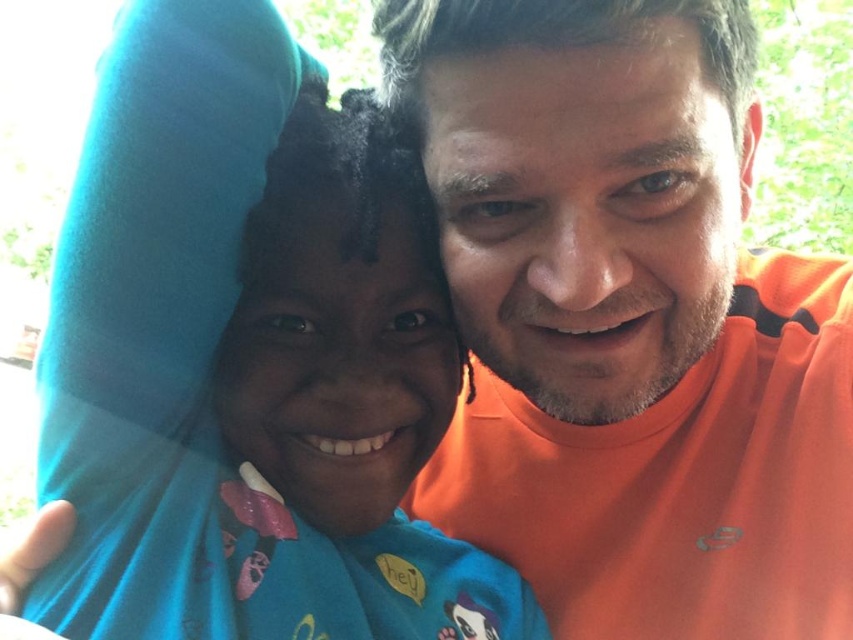
Question: Can you confirm if orange cotton shirt at center is thinner than blue fabric at left?

Choices:
 (A) yes
 (B) no

Answer: (B)

Question: Which point appears farthest from the camera in this image?

Choices:
 (A) (552, 176)
 (B) (437, 308)

Answer: (B)

Question: Observing the image, what is the correct spatial positioning of orange cotton shirt at center in reference to blue fabric at left?

Choices:
 (A) left
 (B) right

Answer: (B)

Question: Which point is farther from the camera taking this photo?

Choices:
 (A) (550, 132)
 (B) (254, 420)

Answer: (B)

Question: Is orange cotton shirt at center smaller than blue fabric at left?

Choices:
 (A) no
 (B) yes

Answer: (A)